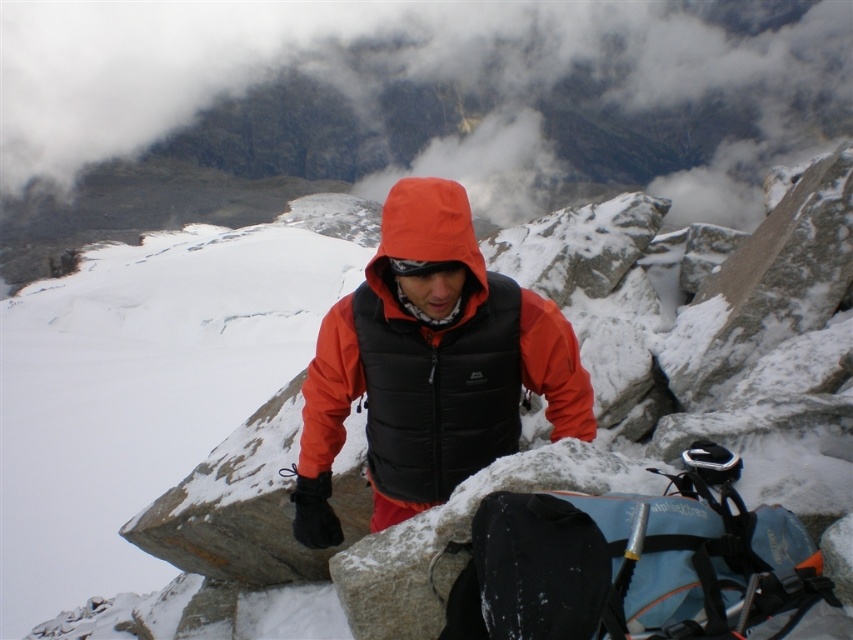
In the scene shown: Does cloudy fog at upper center come behind orange softshell jacket at center?

Yes.

Can you confirm if cloudy fog at upper center is taller than orange softshell jacket at center?

Yes, cloudy fog at upper center is taller than orange softshell jacket at center.

Where is `cloudy fog at upper center`? The height and width of the screenshot is (640, 853). cloudy fog at upper center is located at coordinates (433, 80).